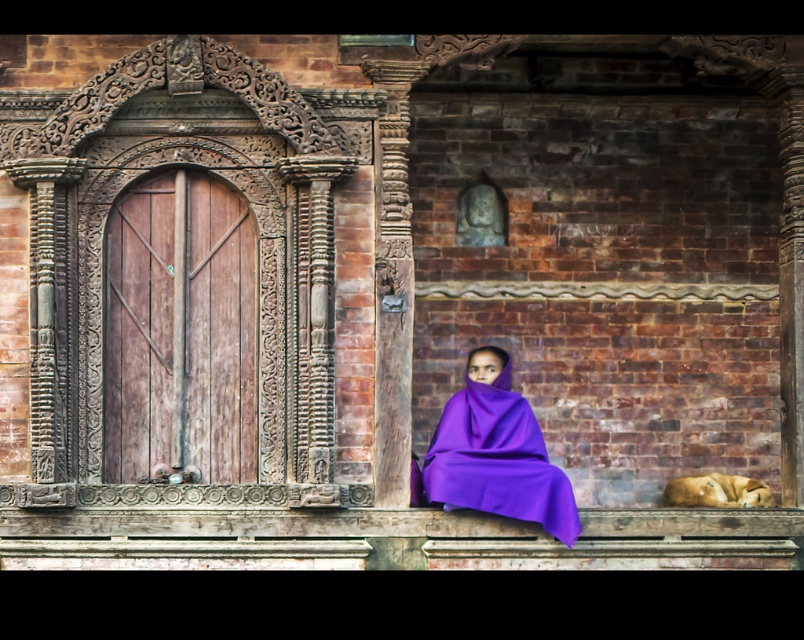
You are standing in front of the wooden door and want to place a small plant between the purple fabric at center and the golden fur dog at lower right. Based on their positions, which object should the plant be closer to?

The purple fabric at center is closer to the viewer than the golden fur dog at lower right, so the plant should be placed closer to the golden fur dog at lower right to maintain a balanced distance between both objects.

You are a painter standing in front of the wooden door and brick wall scene. You need to paint both the purple fabric at center and the golden fur dog at lower right. Which object should you start with if you want to paint the wider one first?

The purple fabric at center is wider than the golden fur dog at lower right, so you should start painting the purple fabric at center first.

You are standing in front of the wooden door and want to hang a small hook on the wall. The hook needs to be placed above the golden fur dog at lower right but below the purple fabric at center. Is this possible based on their positions?

The purple fabric at center is much taller than the golden fur dog at lower right, so there is space between them to place the hook above the golden fur dog at lower right and below the purple fabric at center.